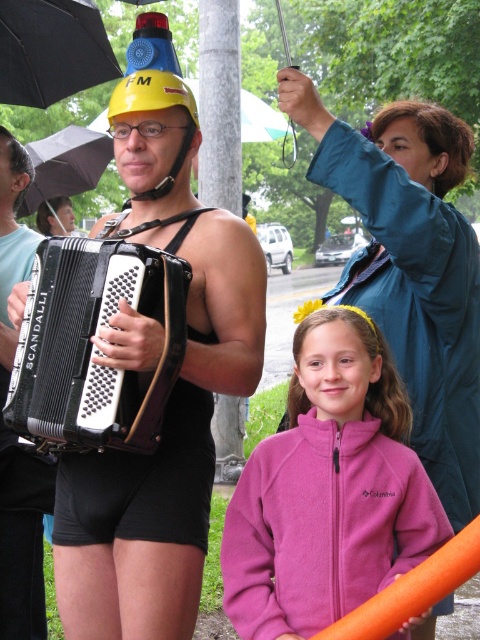
Question: From the image, what is the correct spatial relationship of black matte accordion at center in relation to matte black accordion at center?

Choices:
 (A) right
 (B) left

Answer: (A)

Question: Is pink fleece jacket at lower center further to camera compared to matte black swimsuit at center?

Choices:
 (A) yes
 (B) no

Answer: (B)

Question: Which point is farther from the camera taking this photo?

Choices:
 (A) (14, 193)
 (B) (36, 310)
 (C) (60, 154)

Answer: (C)

Question: Which point is closer to the camera taking this photo?

Choices:
 (A) (72, 435)
 (B) (50, 499)
 (C) (384, 563)
 (D) (91, 150)

Answer: (A)

Question: Which point is closer to the camera?

Choices:
 (A) matte black accordion at center
 (B) matte black swimsuit at center
 (C) black matte accordion at left
 (D) pink fleece jacket at lower center

Answer: (C)

Question: Can you confirm if black matte accordion at center is positioned below black fabric umbrella at upper left?

Choices:
 (A) yes
 (B) no

Answer: (A)